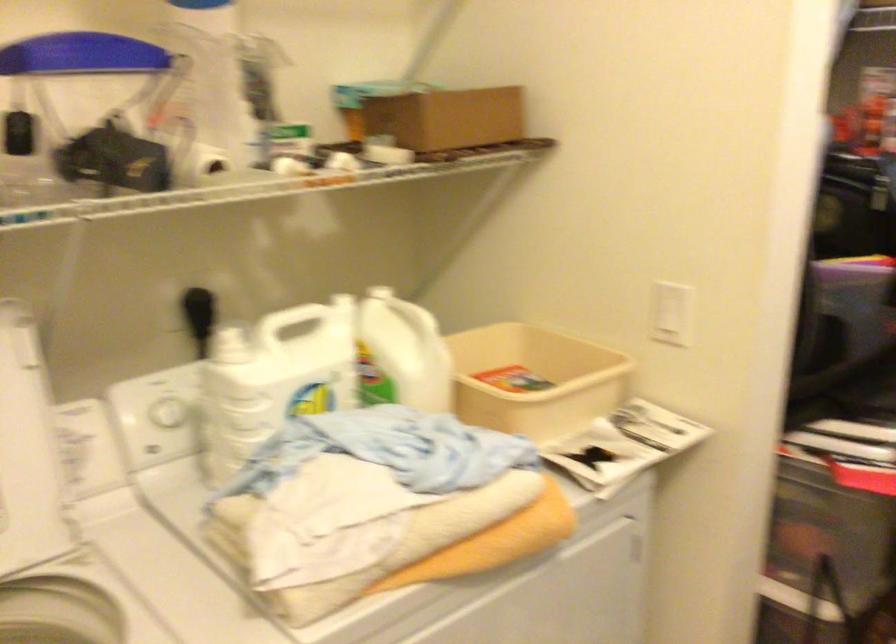
The location [446,118] corresponds to which object?

It corresponds to the cardboard box in the image.